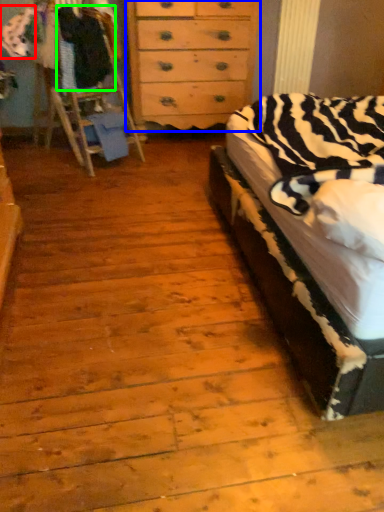
Question: Estimate the real-world distances between objects in this image. Which object is closer to clothing (highlighted by a red box), chest of drawers (highlighted by a blue box) or clothing (highlighted by a green box)?

Choices:
 (A) chest of drawers
 (B) clothing

Answer: (B)